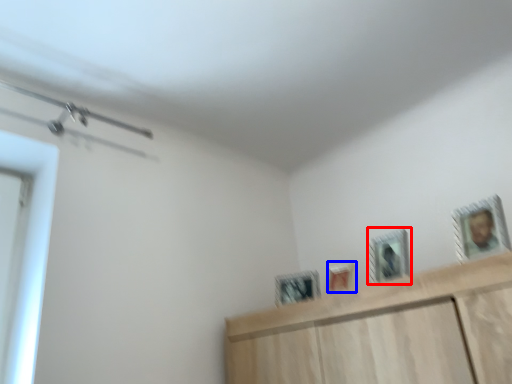
Question: Which of the following is the closest to the observer, picture frame (highlighted by a red box) or picture frame (highlighted by a blue box)?

Choices:
 (A) picture frame
 (B) picture frame

Answer: (A)